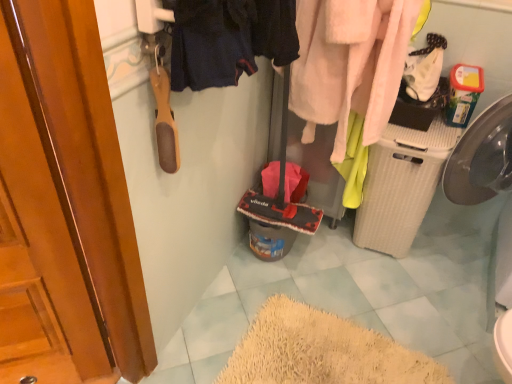
Question: In the image, is dark blue fabric at upper center, the 1th clothing from the front, positioned in front of or behind fuzzy pink towel at upper right, acting as the first clothing starting from the right?

Choices:
 (A) front
 (B) behind

Answer: (A)

Question: In terms of width, does dark blue fabric at upper center, which is counted as the 1th clothing, starting from the left, look wider or thinner when compared to fuzzy pink towel at upper right, placed as the second clothing when sorted from left to right?

Choices:
 (A) thin
 (B) wide

Answer: (A)

Question: Would you say dark blue fabric at upper center, which is counted as the 1th clothing, starting from the left, is to the left or to the right of fuzzy pink towel at upper right, which is the 1th clothing from back to front, in the picture?

Choices:
 (A) right
 (B) left

Answer: (B)

Question: In the image, is fuzzy pink towel at upper right, positioned as the second clothing in front-to-back order, on the left side or the right side of dark blue fabric at upper center, which is counted as the 1th clothing, starting from the left?

Choices:
 (A) right
 (B) left

Answer: (A)

Question: From a real-world perspective, is fuzzy pink towel at upper right, acting as the first clothing starting from the right, positioned above or below dark blue fabric at upper center, placed as the 2th clothing when sorted from right to left?

Choices:
 (A) below
 (B) above

Answer: (A)

Question: From their relative heights in the image, would you say fuzzy pink towel at upper right, which is the 1th clothing from back to front, is taller or shorter than dark blue fabric at upper center, the 1th clothing from the front?

Choices:
 (A) short
 (B) tall

Answer: (B)

Question: In the image, is fuzzy pink towel at upper right, which is the 1th clothing from back to front, positioned in front of or behind dark blue fabric at upper center, the 1th clothing from the front?

Choices:
 (A) front
 (B) behind

Answer: (B)